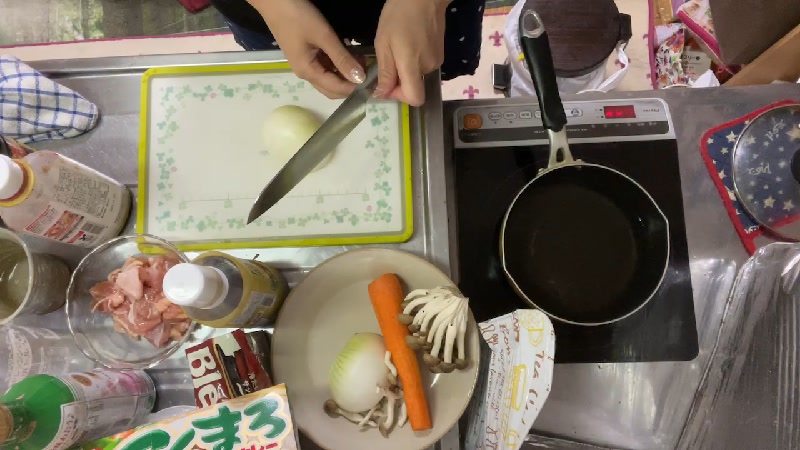
Where is `plate`? plate is located at coordinates (334, 312).